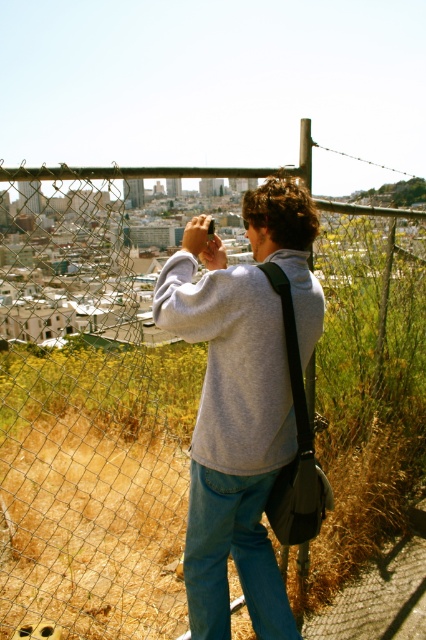
Question: Which of the following is the farthest from the observer?

Choices:
 (A) (218, 419)
 (B) (206, 556)

Answer: (B)

Question: Is gray cotton sweatshirt at center in front of denim at left?

Choices:
 (A) no
 (B) yes

Answer: (B)

Question: Which of the following is the farthest from the observer?

Choices:
 (A) gray cotton sweatshirt at center
 (B) denim at left

Answer: (B)

Question: Observing the image, what is the correct spatial positioning of gray cotton sweatshirt at center in reference to denim at left?

Choices:
 (A) right
 (B) left

Answer: (B)

Question: Can you confirm if gray cotton sweatshirt at center is wider than denim at left?

Choices:
 (A) yes
 (B) no

Answer: (A)